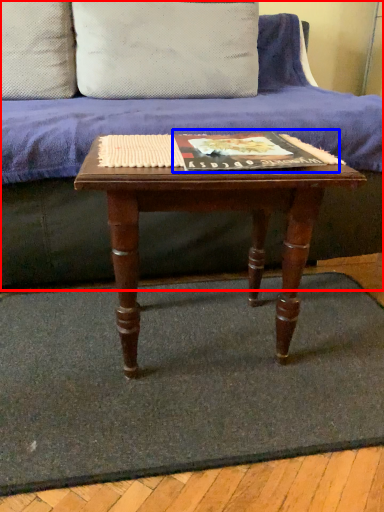
Question: Which object appears closest to the camera in this image, studio couch (highlighted by a red box) or paperback book (highlighted by a blue box)?

Choices:
 (A) studio couch
 (B) paperback book

Answer: (B)